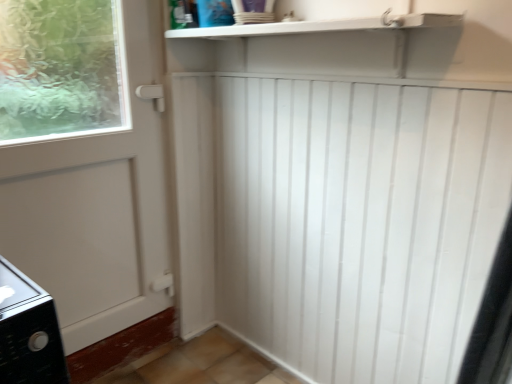
The width and height of the screenshot is (512, 384). What do you see at coordinates (359, 222) in the screenshot?
I see `white matte radiator at upper center` at bounding box center [359, 222].

What is the approximate width of white matte radiator at upper center?

white matte radiator at upper center is 11.95 centimeters wide.

Where is `white matte radiator at upper center`? This screenshot has width=512, height=384. white matte radiator at upper center is located at coordinates tap(359, 222).

The image size is (512, 384). I want to click on white matte radiator at upper center, so click(x=359, y=222).